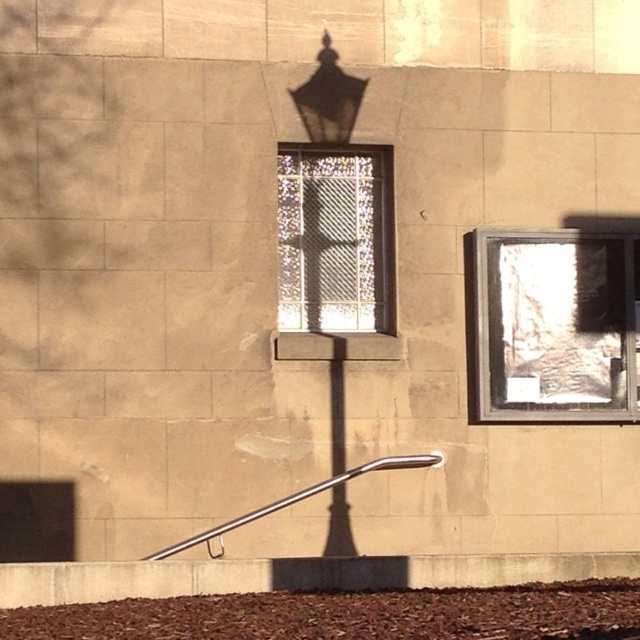
You are standing in front of a building and see the translucent glass window at center right and the matte black lamp at upper center. Which object is positioned to the right of the other?

The translucent glass window at center right is to the right of the matte black lamp at upper center.

You are standing in front of a building with two windows. You see a point marked at coordinates (x=349, y=614). Based on the scene, where is this point located?

The point is on brown mulch at lower center.

You are a maintenance worker needing to replace a broken part. You see the translucent glass window at center right and the satin silver rail at lower center. Which object is located above the other?

The translucent glass window at center right is positioned over the satin silver rail at lower center, so the window is above the rail.